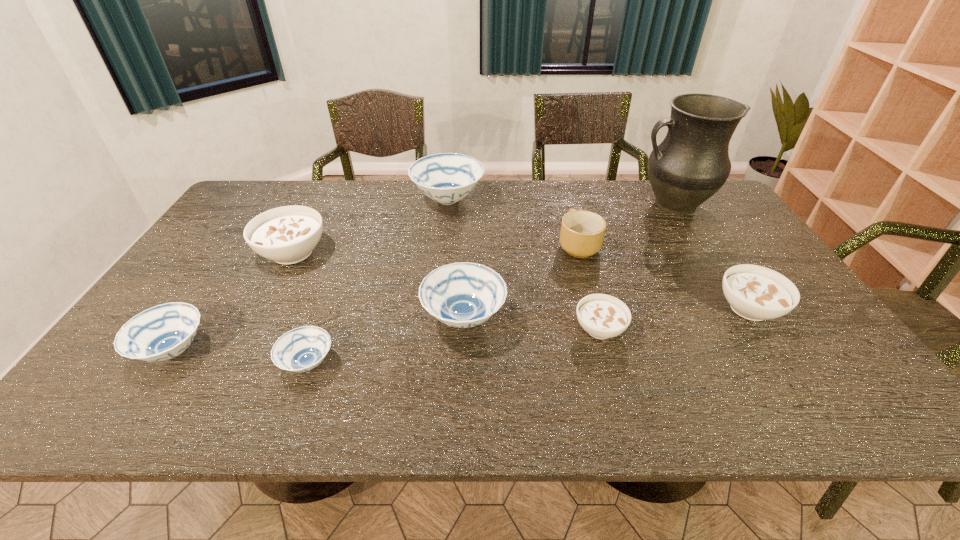
Find the location of a particular element. vacant area that lies between the third biggest blue soup bowl and the sixth soup bowl from left to right is located at coordinates (387, 340).

What are the coordinates of `free space that is in between the leftmost blue soup bowl and the second farthest soup bowl` in the screenshot? It's located at (233, 302).

This screenshot has width=960, height=540. I want to click on unoccupied area between the second farthest soup bowl and the tan mug, so click(x=435, y=248).

Where is `vacant area that lies between the smallest blue soup bowl and the second biggest white soup bowl`? vacant area that lies between the smallest blue soup bowl and the second biggest white soup bowl is located at coordinates (528, 336).

I want to click on vacant region between the farthest soup bowl and the third smallest blue soup bowl, so click(456, 259).

The height and width of the screenshot is (540, 960). Identify the location of vacant region between the biggest blue soup bowl and the second white soup bowl from right to left. (524, 264).

You are a GUI agent. You are given a task and a screenshot of the screen. Output one action in this format:
    pyautogui.click(x=<x>, y=<y>)
    Task: Click on the free space between the biggest blue soup bowl and the smallest blue soup bowl
    
    Given the screenshot: What is the action you would take?
    pyautogui.click(x=378, y=281)

Find the location of a particular element. object that stands as the fifth closest to the mug is located at coordinates (756, 293).

Identify which object is the fifth closest to the farthest blue soup bowl. Please provide its 2D coordinates. Your answer should be formatted as a tuple, i.e. [(x, y)], where the tuple contains the x and y coordinates of a point satisfying the conditions above.

[(691, 164)]

Identify the location of soup bowl that is the second closest to the farthest soup bowl. This screenshot has height=540, width=960. (463, 295).